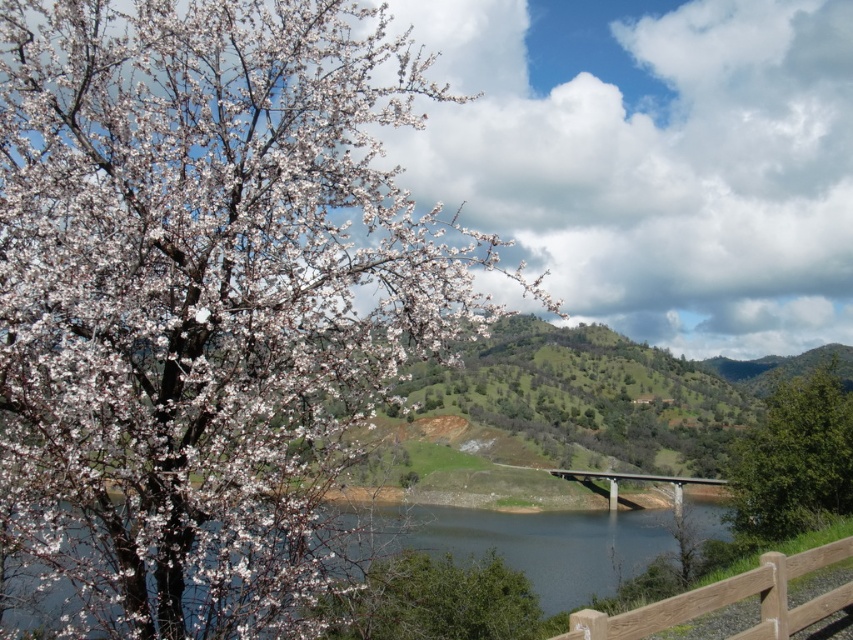
Question: Does green leafy tree at right come behind green leafy tree at lower center?

Choices:
 (A) no
 (B) yes

Answer: (B)

Question: Does green leafy tree at lower center have a greater width compared to brown wooden fence at lower right?

Choices:
 (A) no
 (B) yes

Answer: (B)

Question: Among these points, which one is nearest to the camera?

Choices:
 (A) (55, 307)
 (B) (692, 483)
 (C) (763, 618)

Answer: (C)

Question: Which object is farther from the camera taking this photo?

Choices:
 (A) gray concrete bridge at center
 (B) white matte flower at upper left
 (C) brown wooden fence at lower right

Answer: (A)

Question: Which point is closer to the camera?

Choices:
 (A) brown wooden fence at lower right
 (B) white matte flower at upper left
 (C) gray concrete bridge at center

Answer: (A)

Question: Is green leafy tree at lower center closer to the viewer compared to gray concrete bridge at center?

Choices:
 (A) yes
 (B) no

Answer: (A)